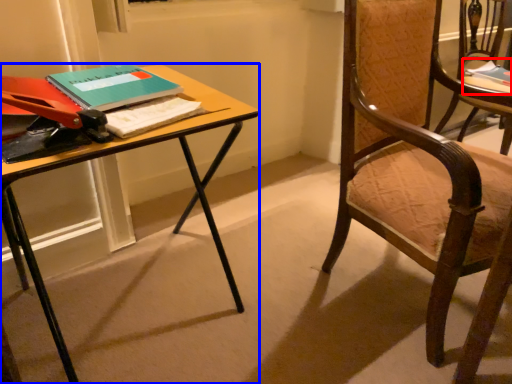
Question: Which object is further to the camera taking this photo, book (highlighted by a red box) or desk (highlighted by a blue box)?

Choices:
 (A) book
 (B) desk

Answer: (A)